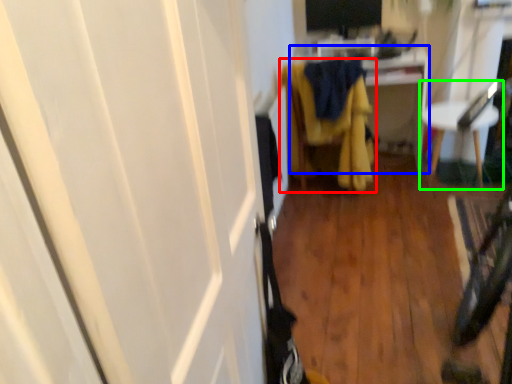
Question: Based on their relative distances, which object is nearer to furniture (highlighted by a red box)? Choose from cabinetry (highlighted by a blue box) and furniture (highlighted by a green box).

Choices:
 (A) cabinetry
 (B) furniture

Answer: (A)